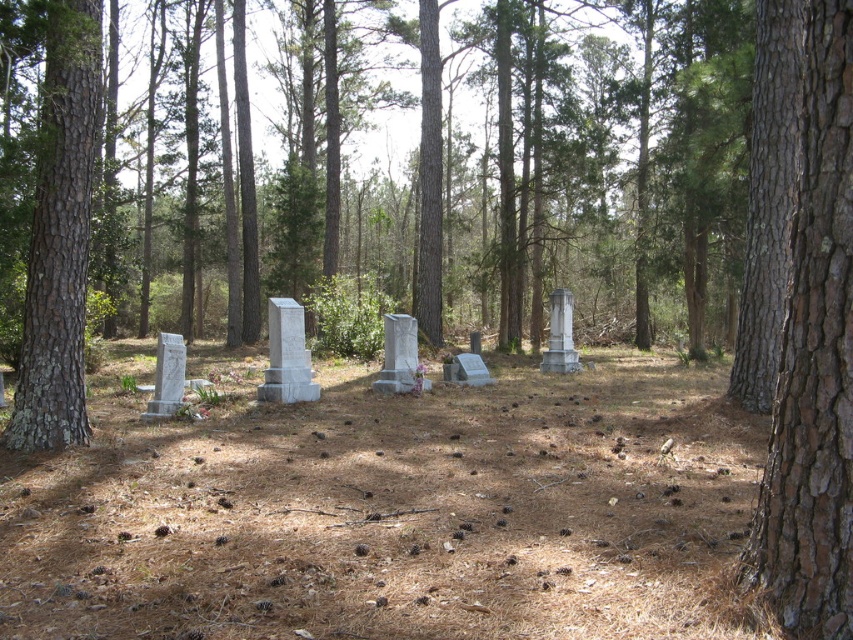
You are standing in the cemetery and want to touch the point at coordinates [814,362]. Which object in the scene should you reach out to?

The point at coordinates [814,362] is located on the brown rough bark tree at right, so you should reach out to the brown rough bark tree at right.